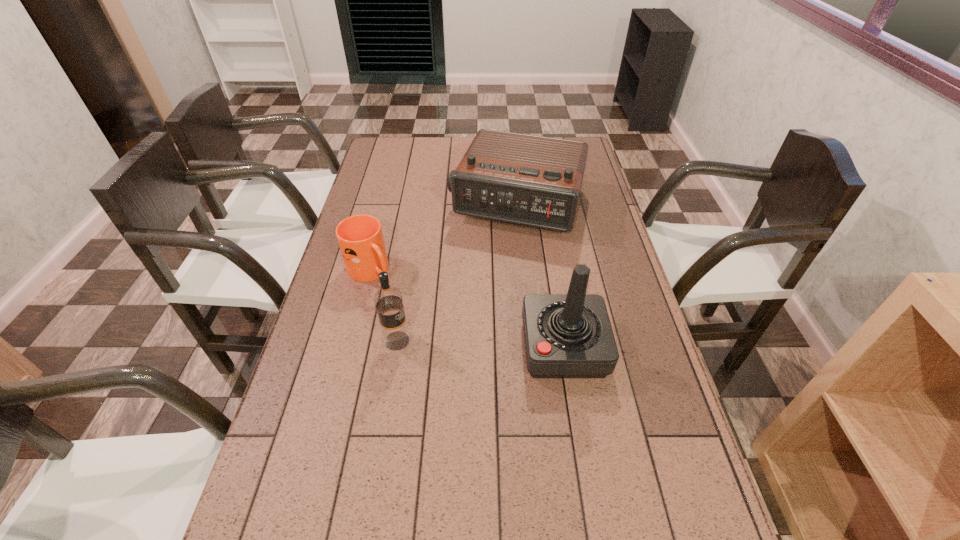
The image size is (960, 540). Identify the location of free spot between the joystick and the second object from left to right. point(480,344).

The height and width of the screenshot is (540, 960). I want to click on unoccupied area between the third object from right to left and the joystick, so click(x=480, y=344).

At what (x,y) coordinates should I click in order to perform the action: click on the third closest object relative to the farthest object. Please return your answer as a coordinate pair (x, y). The width and height of the screenshot is (960, 540). Looking at the image, I should click on (388, 301).

Locate which object ranks third in proximity to the mug. Please provide its 2D coordinates. Your answer should be formatted as a tuple, i.e. [(x, y)], where the tuple contains the x and y coordinates of a point satisfying the conditions above.

[(569, 335)]

Locate an element on the screen. The height and width of the screenshot is (540, 960). vacant region that satisfies the following two spatial constraints: 1. on the front side of the radio receiver; 2. on the front-facing side of the joystick is located at coordinates (532, 347).

Image resolution: width=960 pixels, height=540 pixels. I want to click on free space that satisfies the following two spatial constraints: 1. on the back side of the shortest object; 2. on the left side of the farthest object, so click(x=387, y=205).